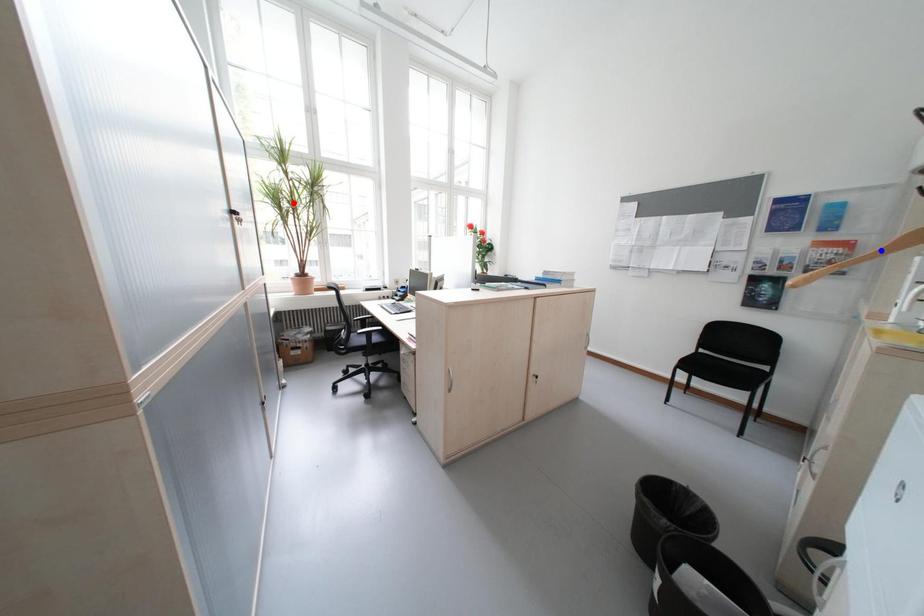
Question: Which of the two points in the image is closer to the camera?

Choices:
 (A) Blue point is closer.
 (B) Red point is closer.

Answer: (A)